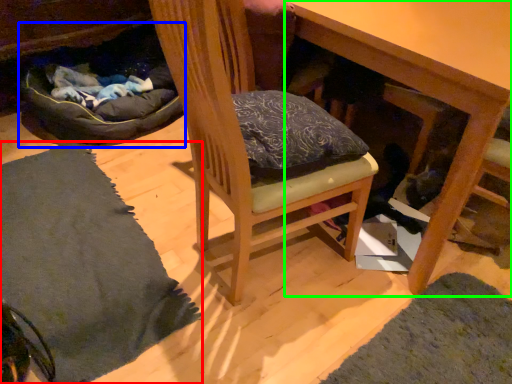
Question: Which is nearer to the mat (highlighted by a red box)? bean bag chair (highlighted by a blue box) or table (highlighted by a green box).

Choices:
 (A) bean bag chair
 (B) table

Answer: (A)